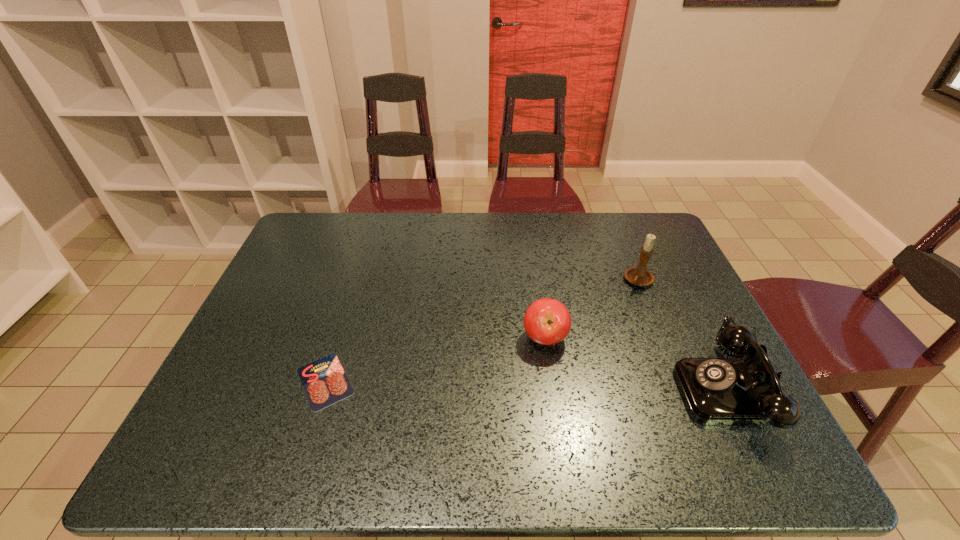
Identify the location of vacant space that satisfies the following two spatial constraints: 1. on the back side of the salami; 2. on the right side of the third object from right to left. (339, 338).

Image resolution: width=960 pixels, height=540 pixels. I want to click on free point that satisfies the following two spatial constraints: 1. on the front side of the shortest object; 2. on the dial of the telephone, so click(323, 389).

Find the location of a particular element. blank space that satisfies the following two spatial constraints: 1. on the back side of the farthest object; 2. on the right side of the apple is located at coordinates (537, 281).

Where is `vacant point that satisfies the following two spatial constraints: 1. on the front side of the candle holder; 2. on the dial of the telephone`? vacant point that satisfies the following two spatial constraints: 1. on the front side of the candle holder; 2. on the dial of the telephone is located at coordinates (684, 389).

Identify the location of vacant space that satisfies the following two spatial constraints: 1. on the back side of the leftmost object; 2. on the right side of the second object from left to right. (339, 338).

Identify the location of vacant position in the image that satisfies the following two spatial constraints: 1. on the back side of the shortest object; 2. on the left side of the candle holder. This screenshot has height=540, width=960. (357, 281).

Locate an element on the screen. The width and height of the screenshot is (960, 540). vacant space that satisfies the following two spatial constraints: 1. on the front side of the telephone; 2. on the dial of the leftmost object is located at coordinates (323, 389).

This screenshot has width=960, height=540. Identify the location of vacant region that satisfies the following two spatial constraints: 1. on the front side of the third object from right to left; 2. on the dial of the telephone. (553, 389).